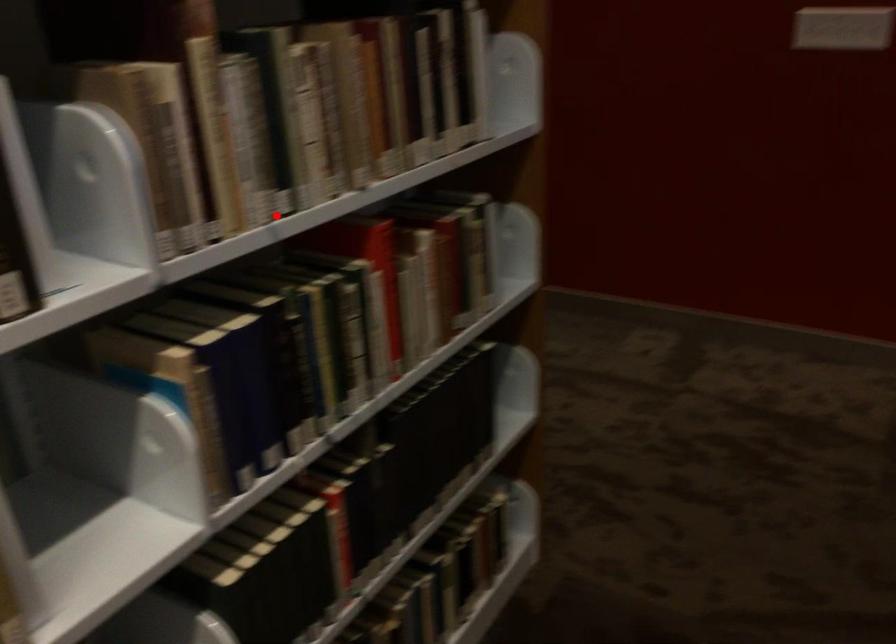
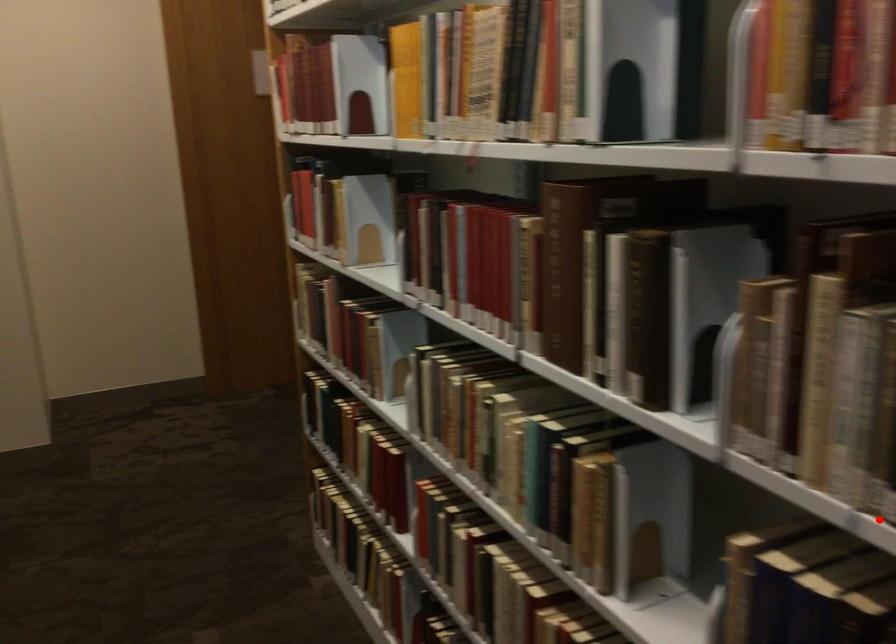
I am providing you with two images of the same scene from different viewpoints. A red point is marked on the first image and another point is marked on the second image. Are the points marked in image1 and image2 representing the same 3D position?

Yes